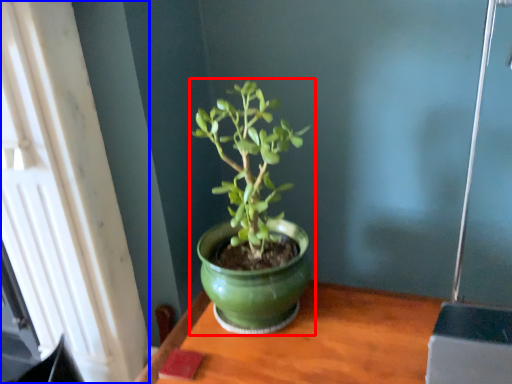
Question: Which point is closer to the camera, houseplant (highlighted by a red box) or window (highlighted by a blue box)?

Choices:
 (A) houseplant
 (B) window

Answer: (B)